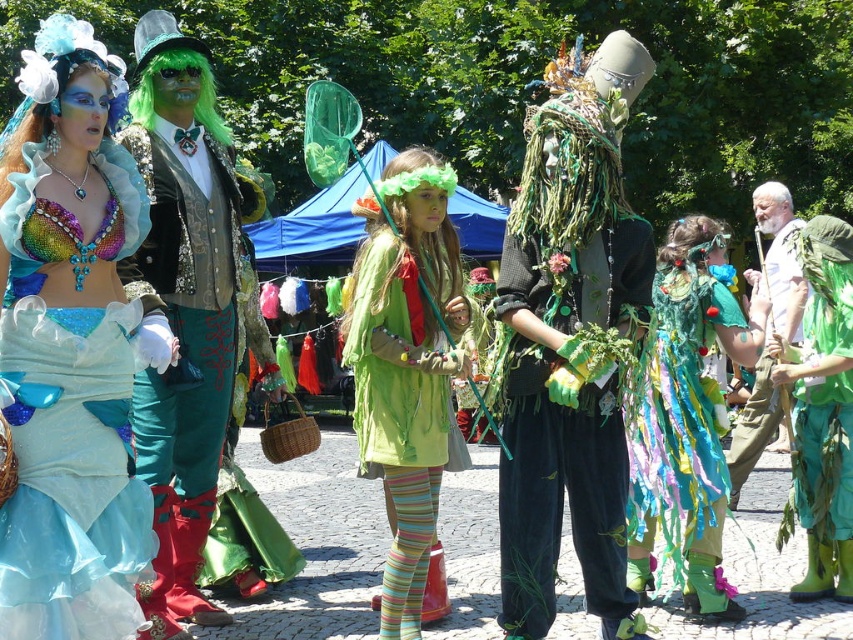
You are a photographer positioned at the center of the scene. You want to take a photo that includes both the shiny sequin top at left and the shiny teal fabric dress at center. Given that your camera has a maximum focus range of 8 meters, will you be able to capture both subjects clearly in the same photo?

The shiny sequin top at left is 8.90 meters away from the shiny teal fabric dress at center. Since the distance between them exceeds the camera maximum focus range of 8 meters, you cannot capture both subjects clearly in the same photo.

You are a costume designer observing the vibrant outdoor scene. You need to determine the spatial relationship between the shiny sequin top at left and the shiny green fabric pants at left. Based on the scene description, which object is positioned higher?

The shiny sequin top at left is positioned above the shiny green fabric pants at left, so the shiny sequin top at left is higher.

You are a photographer at the festival and want to capture a photo of both the velvet green gloves at center and the green fabric dress at center. Since you can only focus on one object at a time, which one should you focus on first to ensure the other is still in the frame?

You should focus on the green fabric dress at center first because the velvet green gloves at center are to the right of it, so by focusing on the dress, the gloves will remain in the frame to its right.